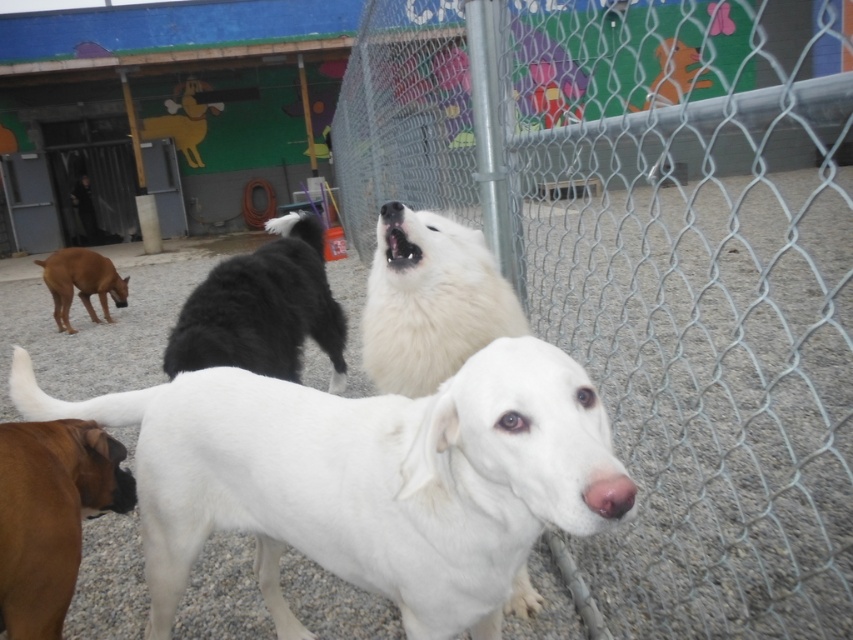
Question: Which is nearer to the brown fur dog at left?

Choices:
 (A) black fluffy dog at center
 (B) brown matte dog at lower left
 (C) white fluffy dog at center
 (D) wire mesh fence at center

Answer: (A)

Question: Observing the image, what is the correct spatial positioning of white fluffy dog at center in reference to black fluffy dog at center?

Choices:
 (A) right
 (B) left

Answer: (A)

Question: Does wire mesh fence at center have a smaller size compared to white smooth dog at center?

Choices:
 (A) yes
 (B) no

Answer: (B)

Question: Which of these objects is positioned closest to the black fluffy dog at center?

Choices:
 (A) brown matte dog at lower left
 (B) brown fur dog at left
 (C) white smooth dog at center

Answer: (A)

Question: From the image, what is the correct spatial relationship of white smooth dog at center in relation to brown matte dog at lower left?

Choices:
 (A) right
 (B) left

Answer: (A)

Question: Among these points, which one is farthest from the camera?

Choices:
 (A) (200, 298)
 (B) (851, 115)
 (C) (148, 456)
 (D) (47, 465)

Answer: (A)